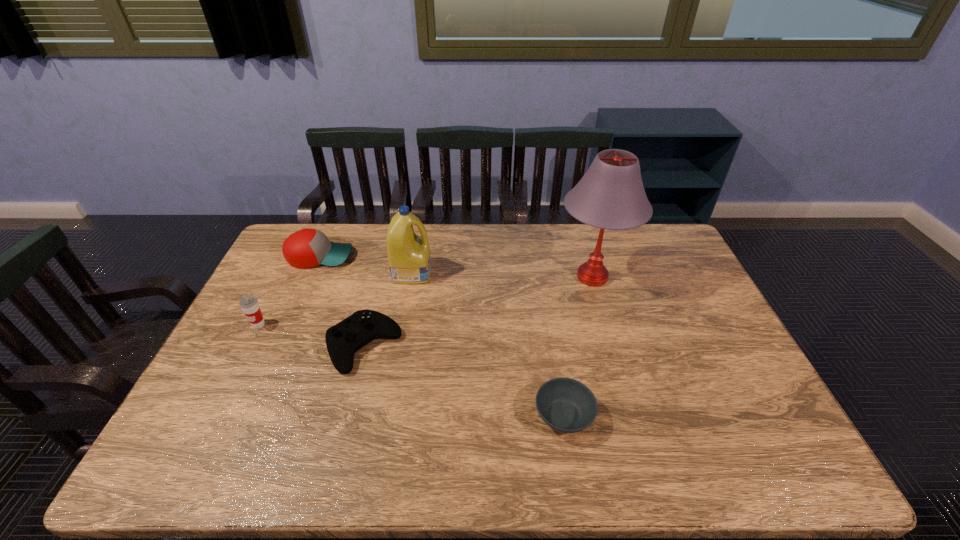
Locate an element on the screen. table lamp is located at coordinates pos(610,195).

What are the coordinates of `the second tallest object` in the screenshot? It's located at pos(409,259).

Identify the location of cup. (249, 304).

You are a GUI agent. You are given a task and a screenshot of the screen. Output one action in this format:
    pyautogui.click(x=<x>, y=<y>)
    Task: Click on the fourth tallest object
    This screenshot has width=960, height=540.
    Given the screenshot: What is the action you would take?
    pyautogui.click(x=308, y=247)

At what (x,y) coordinates should I click in order to perform the action: click on the fifth tallest object. Please return your answer as a coordinate pair (x, y). This screenshot has width=960, height=540. Looking at the image, I should click on (343, 340).

Where is `the nearest object`? Image resolution: width=960 pixels, height=540 pixels. the nearest object is located at coordinates (566, 405).

The width and height of the screenshot is (960, 540). In order to click on soup bowl in this screenshot , I will do `click(566, 405)`.

Where is `vacant region located on the front-facing side of the table lamp`? This screenshot has height=540, width=960. vacant region located on the front-facing side of the table lamp is located at coordinates (466, 276).

Image resolution: width=960 pixels, height=540 pixels. Identify the location of vacant region located on the front-facing side of the table lamp. (521, 276).

Find the location of a particular element. This screenshot has width=960, height=540. free space located 0.390m on the front-facing side of the table lamp is located at coordinates (439, 276).